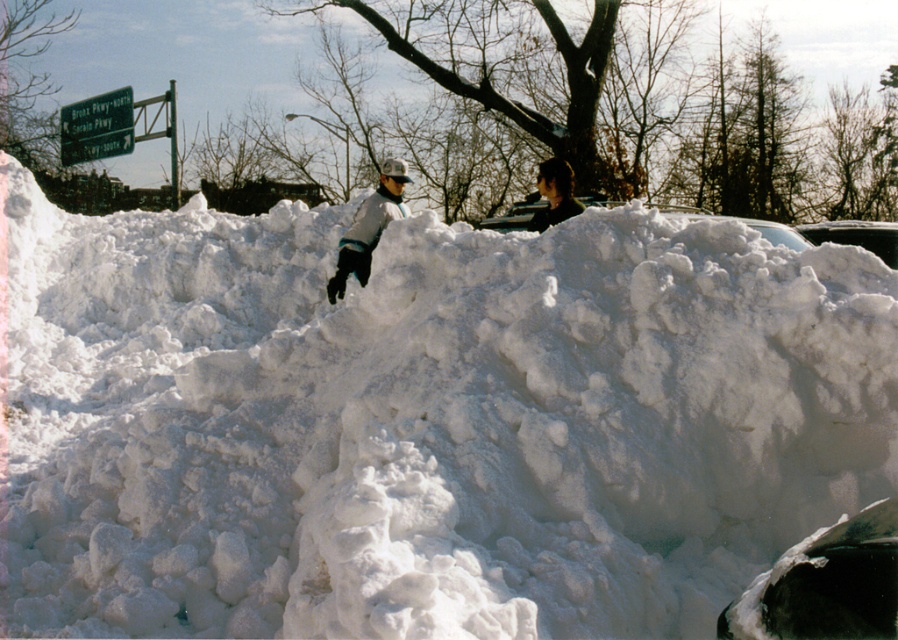
You are a delivery person trying to decide whether to park your delivery van near the clear glass car at upper right or the dark brown hair at upper center. Considering the space required, which location has enough width for your van?

The clear glass car at upper right has a greater width than the dark brown hair at upper center, so the clear glass car at upper right location has enough width for your van.

You are a delivery person needing to reach the clear glass car at upper right. You see the gray fleece jacket at center blocking your path. Can you walk around them?

The gray fleece jacket at center is closer to the viewer than the clear glass car at upper right, so you can walk around them to reach the clear glass car at upper right.